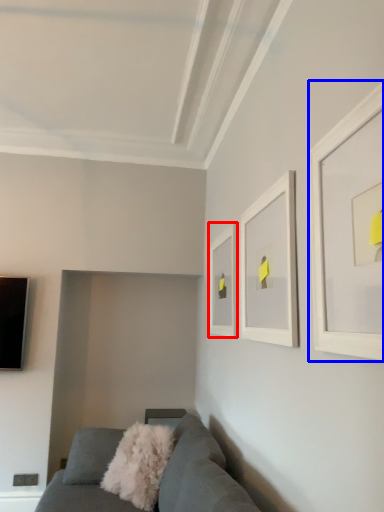
Question: Which point is further to the camera, picture frame (highlighted by a red box) or picture frame (highlighted by a blue box)?

Choices:
 (A) picture frame
 (B) picture frame

Answer: (A)